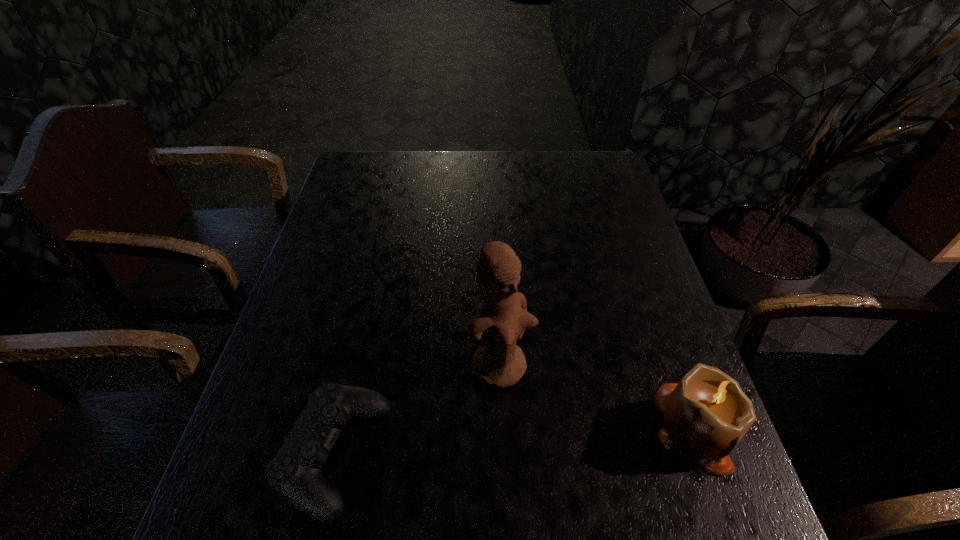
This screenshot has height=540, width=960. What are the coordinates of `the second shortest object` in the screenshot? It's located at (294, 473).

Where is `the third shortest object`? the third shortest object is located at coordinates (706, 414).

Where is `candle`? The height and width of the screenshot is (540, 960). candle is located at coordinates (706, 414).

The image size is (960, 540). In order to click on the shortest object in this screenshot , I will do `click(380, 276)`.

At what (x,y) coordinates should I click in order to perform the action: click on the farthest object. Please return your answer as a coordinate pair (x, y). Looking at the image, I should click on (380, 276).

What are the coordinates of `figurine` in the screenshot? It's located at pyautogui.click(x=498, y=362).

The width and height of the screenshot is (960, 540). What are the coordinates of `the tallest object` in the screenshot? It's located at [498, 362].

Image resolution: width=960 pixels, height=540 pixels. Find the location of `free location located on the right of the control`. free location located on the right of the control is located at coordinates (567, 456).

I want to click on vacant space located on the left of the second tallest object, so (487, 427).

Identify the location of vacant region located on the front-facing side of the farthest object. The height and width of the screenshot is (540, 960). (488, 397).